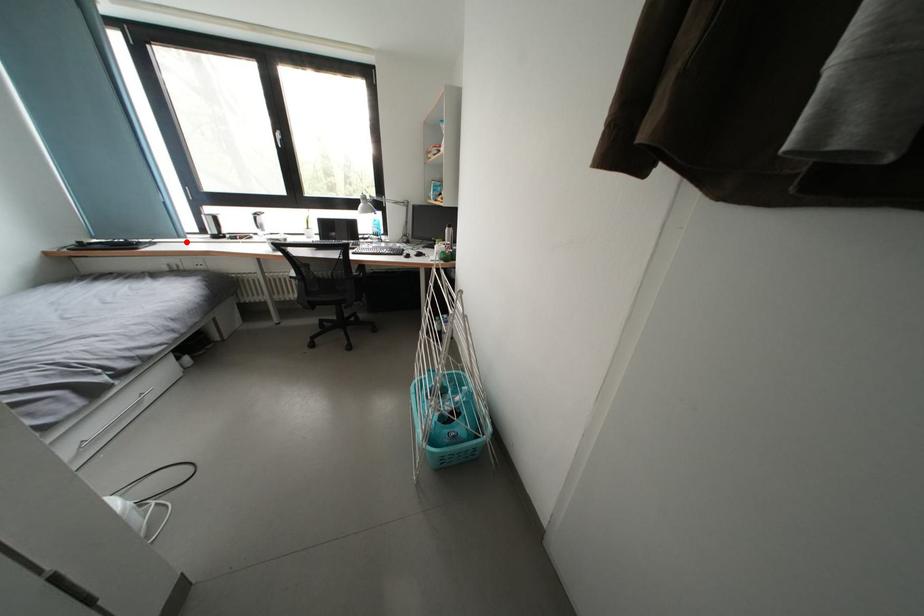
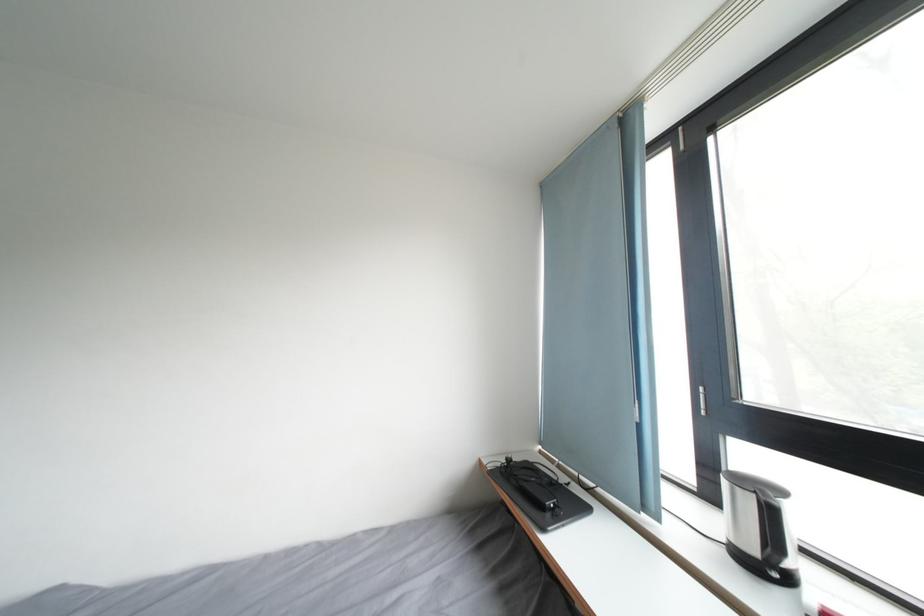
Find the pixel in the second image that matches the highlighted location in the first image.

(651, 514)